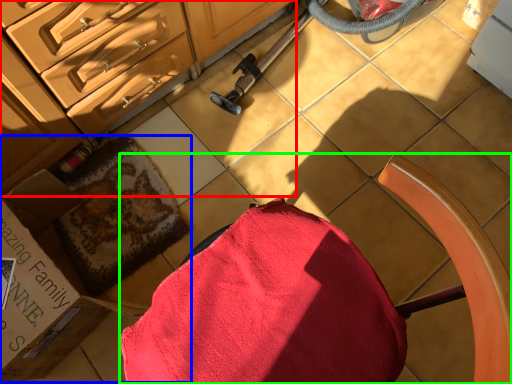
Question: Estimate the real-world distances between objects in this image. Which object is farther from cabinetry (highlighted by a red box), box (highlighted by a blue box) or chair (highlighted by a green box)?

Choices:
 (A) box
 (B) chair

Answer: (B)